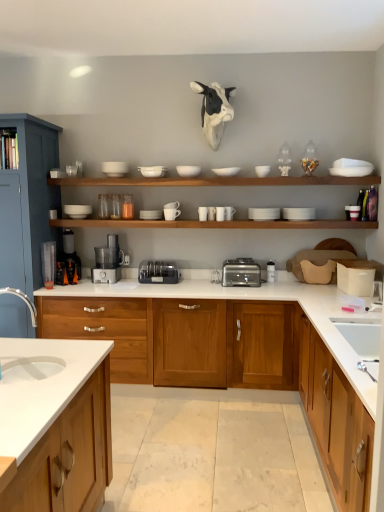
Question: Is white matte cup at center, placed as the 8th tableware when sorted from left to right, bigger or smaller than silver metallic toaster at center?

Choices:
 (A) small
 (B) big

Answer: (A)

Question: Is point (223, 220) closer or farther from the camera than point (251, 281)?

Choices:
 (A) closer
 (B) farther

Answer: (A)

Question: Based on their relative distances, which object is nearer to the white matte bowl at upper center, which is counted as the sixth tableware, starting from the right?

Choices:
 (A) white matte bowls at upper center
 (B) white matte cup at upper right, positioned as the first tableware in right-to-left order
 (C) brushed metal cabinet at left, positioned as the third cabinetry in right-to-left order
 (D) silver metallic toaster at center
 (E) white matte cup at upper center, which is the 9th tableware from right to left

Answer: (E)

Question: Considering the real-world distances, which object is closest to the white matte bowls at upper center?

Choices:
 (A) white matte cup at center, which is counted as the seventh tableware, starting from the right
 (B) white glossy sink at lower right, the second sink viewed from the front
 (C) white matte bowl at upper center, acting as the first tableware starting from the left
 (D) white matte bowl at upper center, which ranks as the ninth tableware in left-to-right order
 (E) white matte cup at upper right, marked as the 14th tableware in a left-to-right arrangement

Answer: (D)